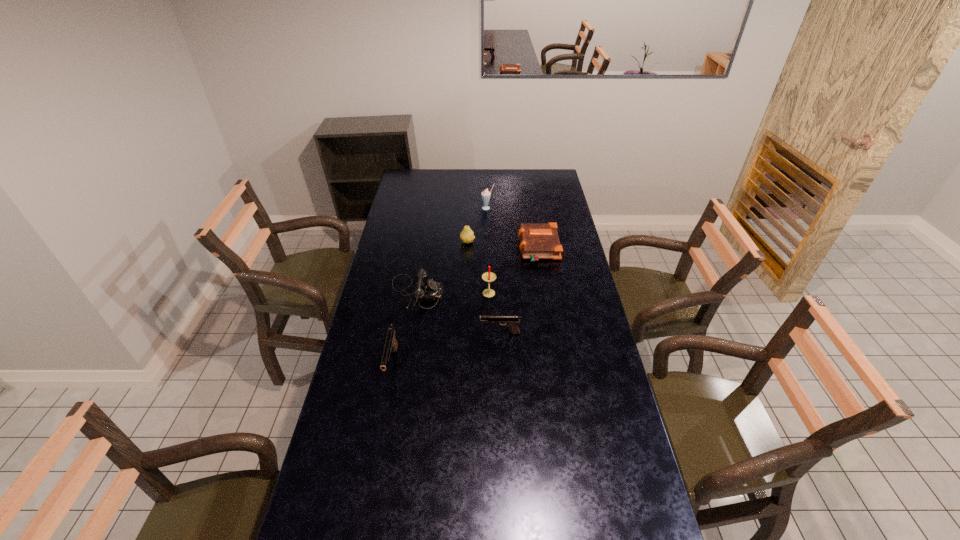
Find the location of a particular element. free space located 0.060m on the front of the fifth object from right to left is located at coordinates (468, 254).

This screenshot has height=540, width=960. I want to click on pistol that is positioned at the left edge, so click(391, 344).

Locate an element on the screen. telephone that is at the left edge is located at coordinates (429, 290).

The image size is (960, 540). Identify the location of object at the right edge. (538, 241).

Image resolution: width=960 pixels, height=540 pixels. I want to click on free location at the far edge, so click(x=474, y=174).

This screenshot has height=540, width=960. Find the location of `free space at the near edge`. free space at the near edge is located at coordinates (534, 501).

Where is `vacant region at the left edge`? This screenshot has width=960, height=540. vacant region at the left edge is located at coordinates (350, 404).

The width and height of the screenshot is (960, 540). What are the coordinates of `vacant space at the right edge of the desktop` in the screenshot? It's located at (589, 306).

Locate an element on the screen. The image size is (960, 540). free space between the right pistol and the nearer pistol is located at coordinates (445, 349).

Where is `empty space that is in between the nearer pistol and the telephone`? empty space that is in between the nearer pistol and the telephone is located at coordinates (404, 329).